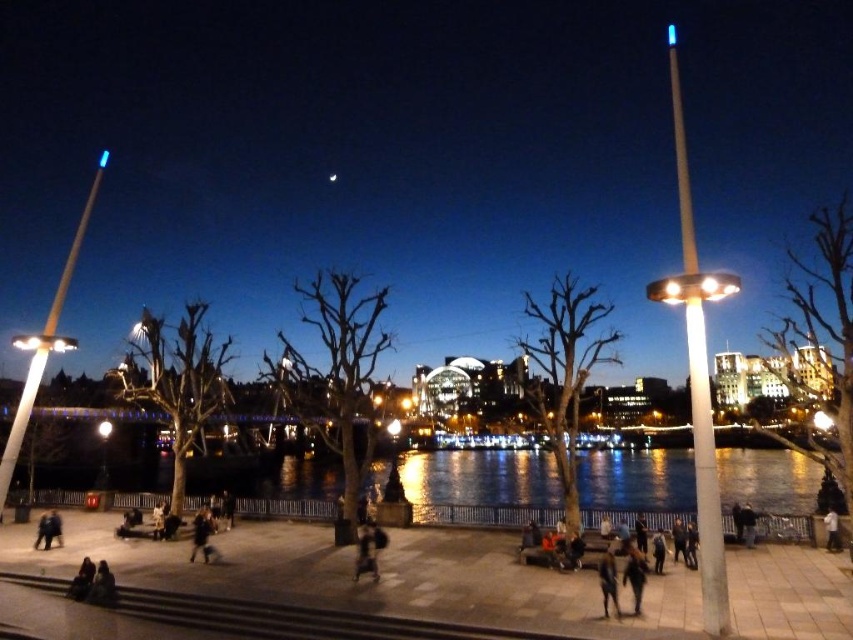
You are a fashion designer observing the scene at the riverside promenade. You notice a person wearing a black matte jacket at lower center and dark blue jeans at lower center. Which clothing item is shorter in length?

The black matte jacket at lower center is shorter than the dark blue jeans at lower center.

You are standing at the riverside promenade and want to reach a specific location marked by the point at coordinates (643, 561). If your walking speed is 1.5 meters per second, how many seconds will it take you to reach that point?

The point at coordinates (643, 561) is 60.73 meters away from you. At a walking speed of 1.5 meters per second, it will take approximately 40.49 seconds to reach the point. Since we usually round to the nearest whole number, it would take about 40 seconds.